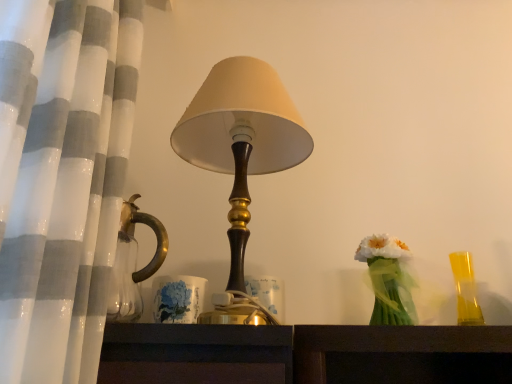
Question: Is translucent yellow glass at right wider or thinner than matte brown lampshade at center?

Choices:
 (A) thin
 (B) wide

Answer: (A)

Question: Is point (479, 314) closer or farther from the camera than point (181, 120)?

Choices:
 (A) farther
 (B) closer

Answer: (B)

Question: Considering the real-world distances, which object is farthest from the white sheer curtain at left?

Choices:
 (A) matte brown lampshade at center
 (B) translucent green vase at right
 (C) translucent yellow glass at right

Answer: (C)

Question: Which object is the closest to the matte brown lampshade at center?

Choices:
 (A) translucent yellow glass at right
 (B) translucent green vase at right
 (C) white sheer curtain at left

Answer: (C)